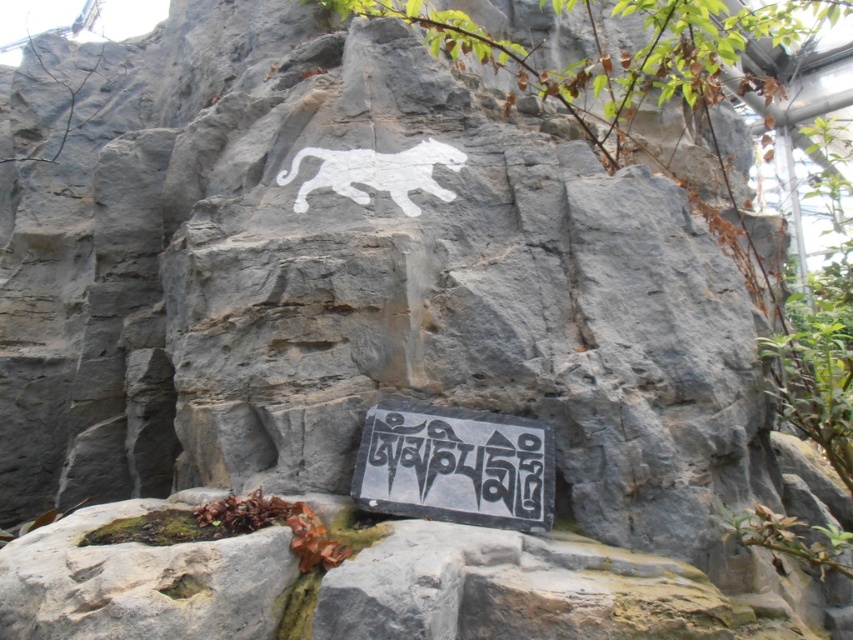
Question: Is black stone sign at lower center positioned at the back of white painted tiger at center?

Choices:
 (A) yes
 (B) no

Answer: (B)

Question: Does black stone sign at lower center have a lesser width compared to white painted tiger at center?

Choices:
 (A) no
 (B) yes

Answer: (B)

Question: Is the position of black stone sign at lower center less distant than that of white painted tiger at center?

Choices:
 (A) yes
 (B) no

Answer: (A)